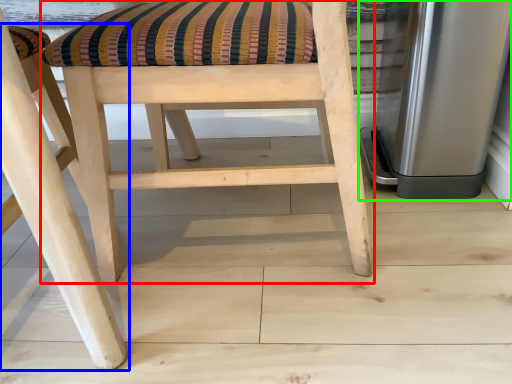
Question: Considering the real-world distances, which object is farthest from chair (highlighted by a red box)? chair (highlighted by a blue box) or appliance (highlighted by a green box)?

Choices:
 (A) chair
 (B) appliance

Answer: (B)